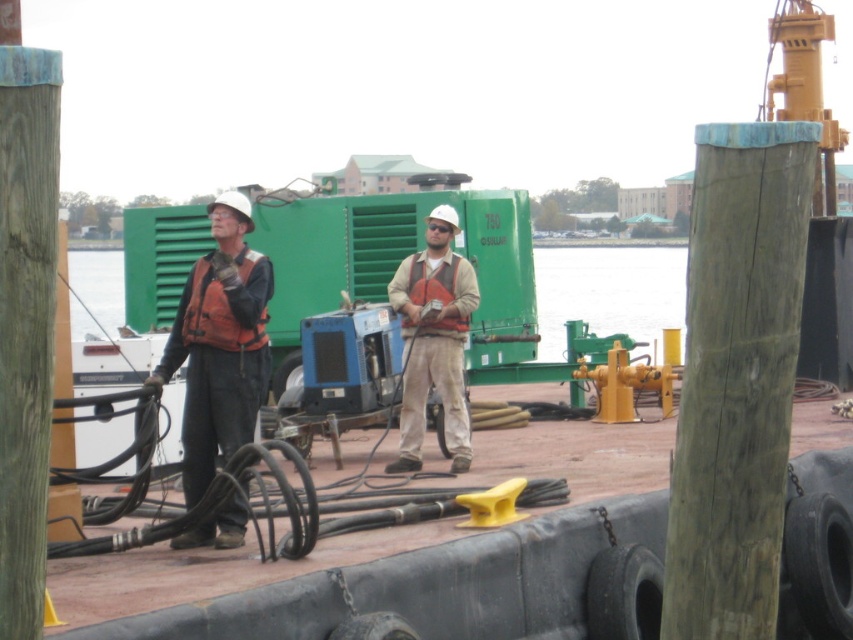
You are a safety inspector at the dock. You need to ensure that the orange life vest at center and the matte orange vest at center are positioned correctly according to safety protocols. According to the scene description, which vest is closer to the left side of the area?

The orange life vest at center is closer to the left side because it is positioned to the left of the matte orange vest at center.